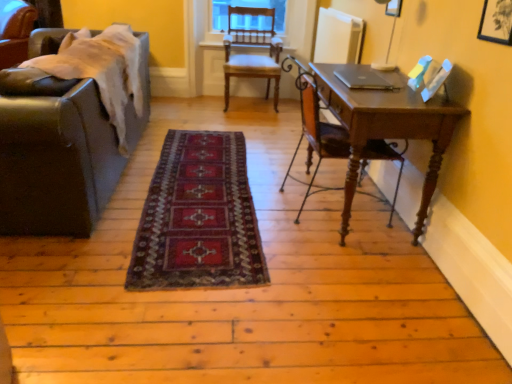
Locate an element on the screen. The image size is (512, 384). vacant space in front of wooden chair at right, the first chair in the front-to-back sequence is located at coordinates click(x=339, y=258).